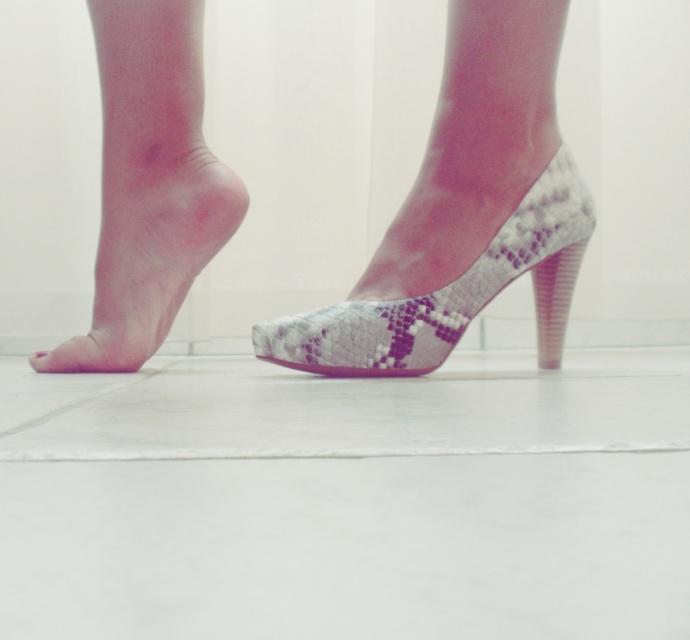
You are an interior designer working on a project. You need to place a decorative item exactly at the position of the snake skin high heel at lower right. What are the coordinates where you should place it?

The snake skin high heel at lower right is located at coordinates (451,198), so you should place the decorative item at those coordinates.